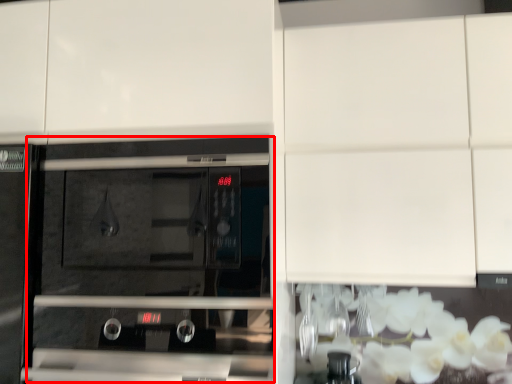
Question: From the image, what is the correct spatial relationship of oven (annotated by the red box) in relation to cabinetry?

Choices:
 (A) right
 (B) left

Answer: (B)